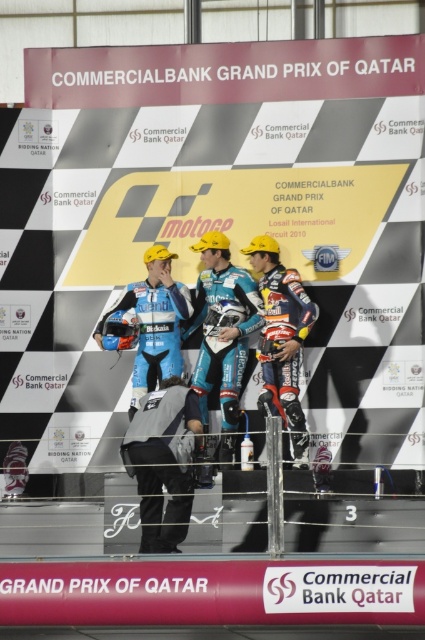
Who is positioned more to the right, teal matte suit at center or gray fabric jacket at center?

Positioned to the right is teal matte suit at center.

Is teal matte suit at center in front of gray fabric jacket at center?

No, teal matte suit at center is further to the viewer.

Does point (235, 339) come closer to viewer compared to point (181, 468)?

No, (235, 339) is further to viewer.

Find the location of a particular element. teal matte suit at center is located at coordinates (223, 332).

Which is in front, point (221, 273) or point (164, 292)?

Point (221, 273) is more forward.

Is point (206, 292) less distant than point (153, 362)?

That is False.

The height and width of the screenshot is (640, 425). I want to click on teal matte suit at center, so click(x=223, y=332).

Identify the location of teal matte suit at center. (223, 332).

Who is positioned more to the left, teal matte suit at center or shiny red motorcycle racer at center?

teal matte suit at center

Is point (260, 301) closer to camera compared to point (291, 352)?

No, it is not.

Who is more distant from viewer, (x=200, y=275) or (x=289, y=300)?

Point (x=200, y=275)

The height and width of the screenshot is (640, 425). I want to click on teal matte suit at center, so click(223, 332).